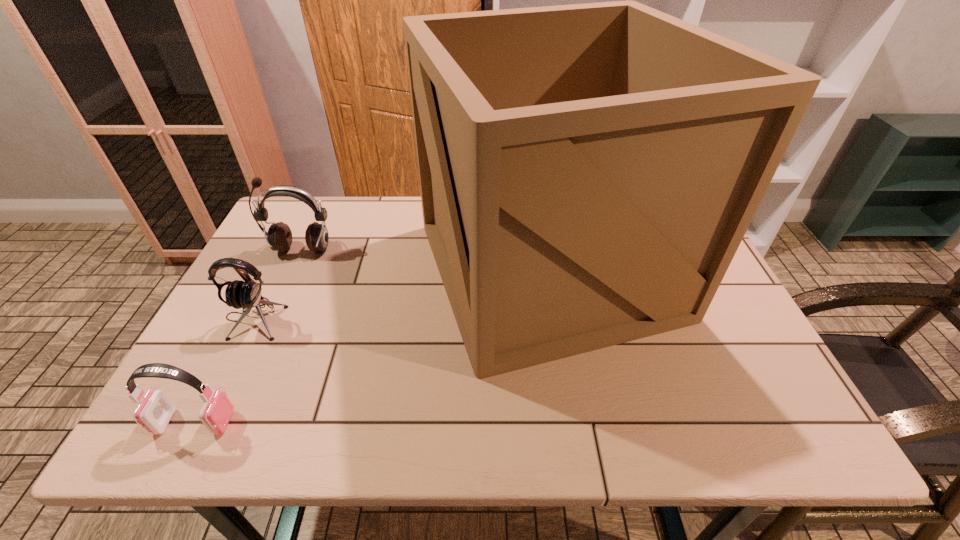
Identify the location of the tallest object. Image resolution: width=960 pixels, height=540 pixels. (587, 172).

This screenshot has height=540, width=960. Identify the location of box. (587, 172).

This screenshot has width=960, height=540. In order to click on the farthest earphone in this screenshot , I will do `click(279, 236)`.

I want to click on the second farthest earphone, so click(x=239, y=294).

Find the location of `the nearest earphone`. the nearest earphone is located at coordinates (155, 412).

At what (x,y) coordinates should I click in order to perform the action: click on vacant area located on the front of the rightmost object. Please return your answer as a coordinate pair (x, y). Looking at the image, I should click on (571, 412).

Locate an element on the screen. The height and width of the screenshot is (540, 960). vacant position located 0.230m on the ear pads of the farthest earphone is located at coordinates (268, 320).

Locate an element on the screen. The height and width of the screenshot is (540, 960). vacant space located 0.060m on the front of the second nearest earphone is located at coordinates (231, 362).

This screenshot has width=960, height=540. In order to click on vacant region located 0.140m on the outer surface of the nearest object in this screenshot , I will do `click(300, 422)`.

This screenshot has height=540, width=960. Find the location of `box located at the far edge`. box located at the far edge is located at coordinates (587, 172).